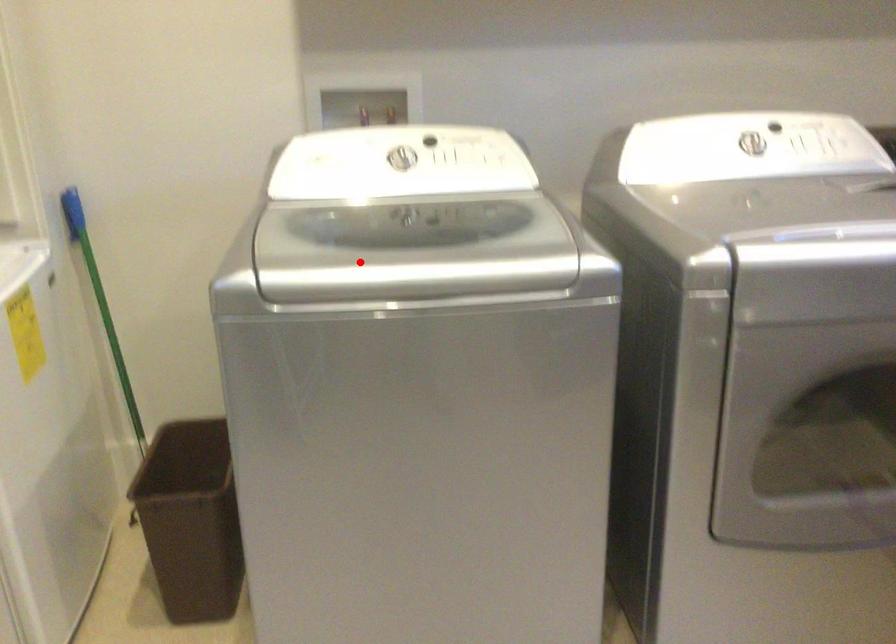
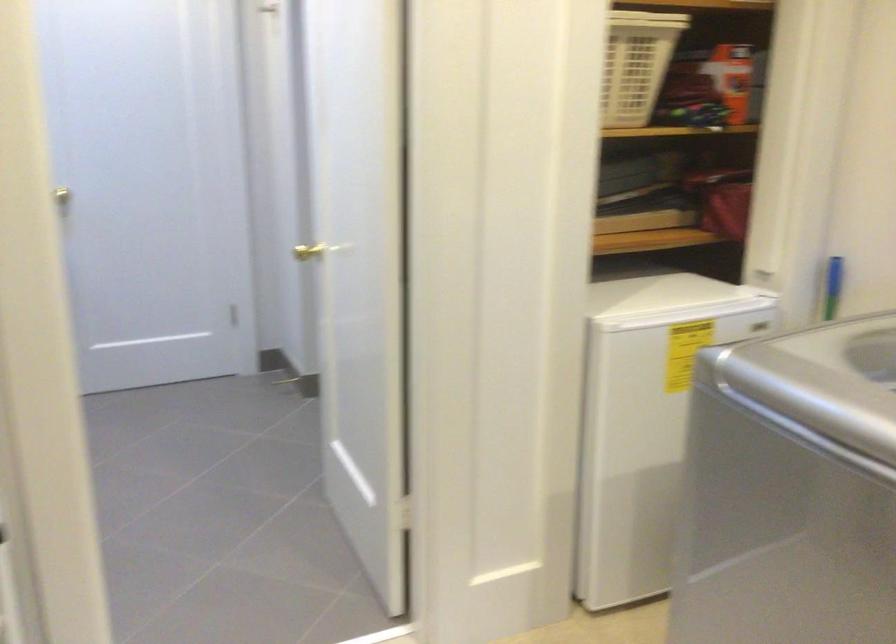
Question: I am providing you with two images of the same scene from different viewpoints. A red point is shown in image1. For the corresponding object point in image2, is it positioned nearer or farther from the camera?

Choices:
 (A) Nearer
 (B) Farther

Answer: (A)